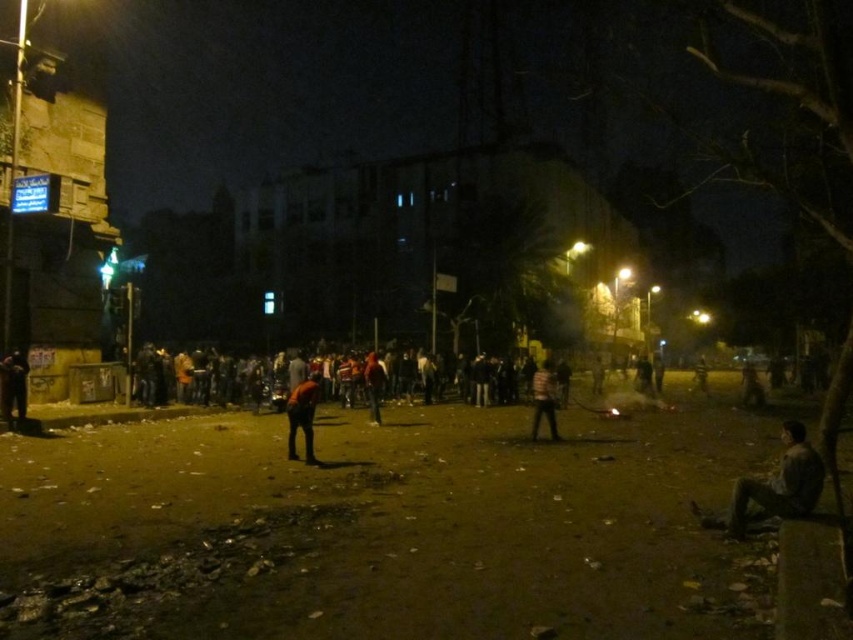
Question: Observing the image, what is the correct spatial positioning of striped shirt at center in reference to orange fabric shirt at center?

Choices:
 (A) above
 (B) below

Answer: (B)

Question: Which point is closer to the camera?

Choices:
 (A) (15, 358)
 (B) (381, 387)
 (C) (310, 433)

Answer: (C)

Question: Is dark clothing figure at left positioned in front of striped shirt at center?

Choices:
 (A) yes
 (B) no

Answer: (B)

Question: Is dark brown leather jacket at center wider than orange fabric shirt at center?

Choices:
 (A) no
 (B) yes

Answer: (B)

Question: Which of the following is the closest to the observer?

Choices:
 (A) (367, 388)
 (B) (12, 349)
 (C) (300, 392)

Answer: (C)

Question: Considering the real-world distances, which object is farthest from the orange fabric shirt at center?

Choices:
 (A) dark brown leather jacket at center
 (B) striped shirt at center
 (C) dark clothing figure at left

Answer: (C)